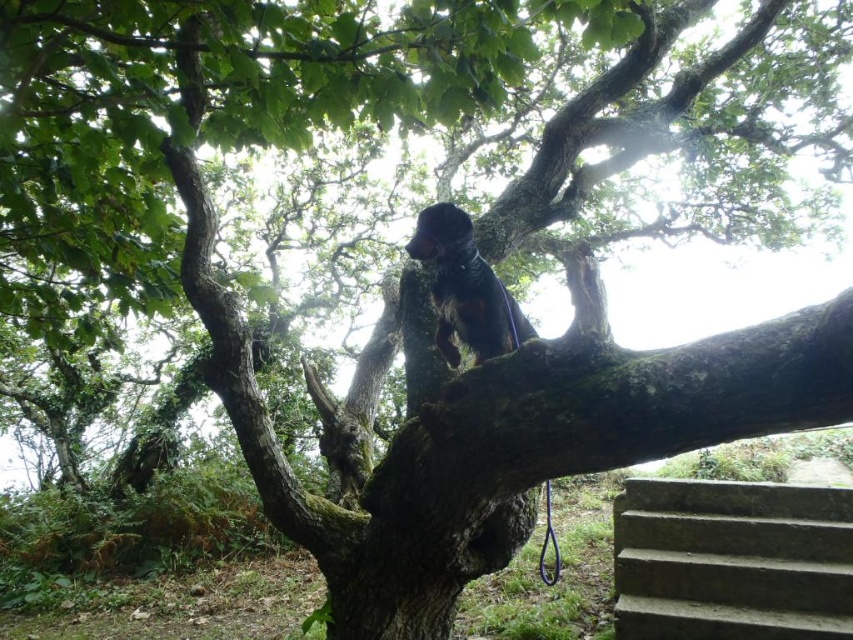
Question: Which point is farther from the camera taking this photo?

Choices:
 (A) coord(451,284)
 (B) coord(822,557)

Answer: (B)

Question: Is gray concrete stairs at lower right positioned before shiny brown fur at upper center?

Choices:
 (A) no
 (B) yes

Answer: (A)

Question: Which object is farther from the camera taking this photo?

Choices:
 (A) shiny brown fur at upper center
 (B) gray concrete stairs at lower right

Answer: (B)

Question: Considering the relative positions of gray concrete stairs at lower right and shiny brown fur at upper center in the image provided, where is gray concrete stairs at lower right located with respect to shiny brown fur at upper center?

Choices:
 (A) above
 (B) below

Answer: (B)

Question: Is gray concrete stairs at lower right bigger than shiny brown fur at upper center?

Choices:
 (A) yes
 (B) no

Answer: (A)